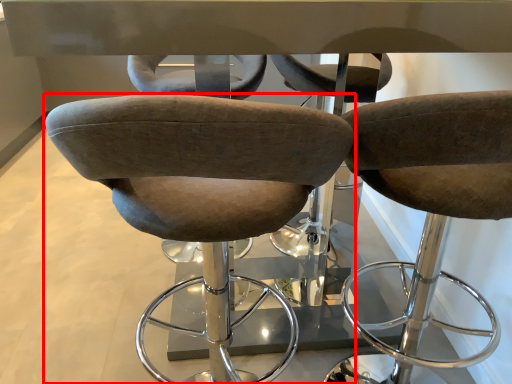
Question: From the image, what is the correct spatial relationship of chair (annotated by the red box) in relation to chair?

Choices:
 (A) right
 (B) left

Answer: (B)